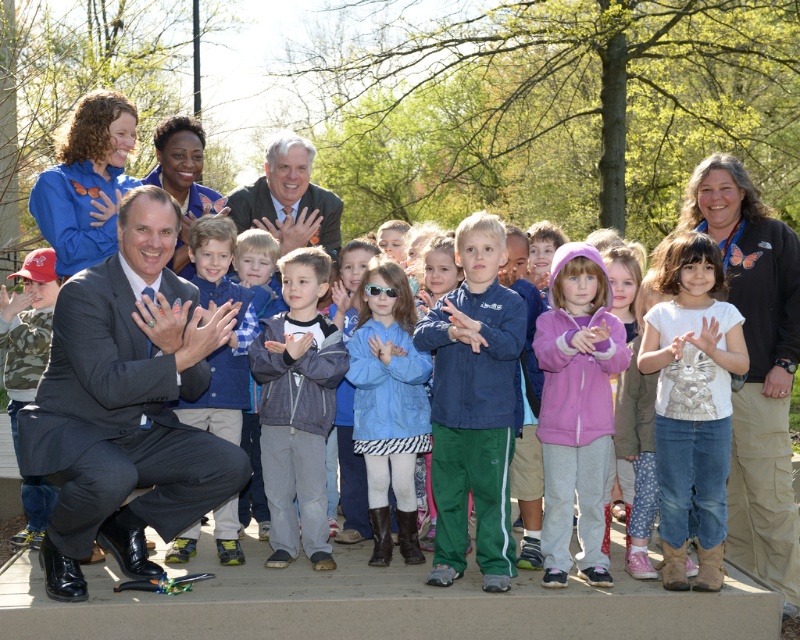
Question: Observing the image, what is the correct spatial positioning of white matte shirt at center in reference to gray fleece jacket at center?

Choices:
 (A) below
 (B) above

Answer: (B)

Question: Which object is positioned closest to the blue fabric jacket at center?

Choices:
 (A) purple fleece jacket at center
 (B) blue matte jacket at center
 (C) gray fleece jacket at center
 (D) dark gray suit at center

Answer: (A)

Question: Which is nearer to the purple fleece jacket at center?

Choices:
 (A) blue fabric jacket at center
 (B) blue matte jacket at center
 (C) dark gray suit at center

Answer: (A)

Question: Does purple fleece jacket at center have a lesser width compared to gray fleece jacket at center?

Choices:
 (A) yes
 (B) no

Answer: (A)

Question: Can you confirm if blue fabric jacket at center is positioned above white matte shirt at center?

Choices:
 (A) no
 (B) yes

Answer: (B)

Question: Which object is the closest to the matte black suit at center?

Choices:
 (A) camo fabric shirt at lower left
 (B) blue fabric jacket at center
 (C) blue plaid shirt at center
 (D) dark gray suit at center

Answer: (C)